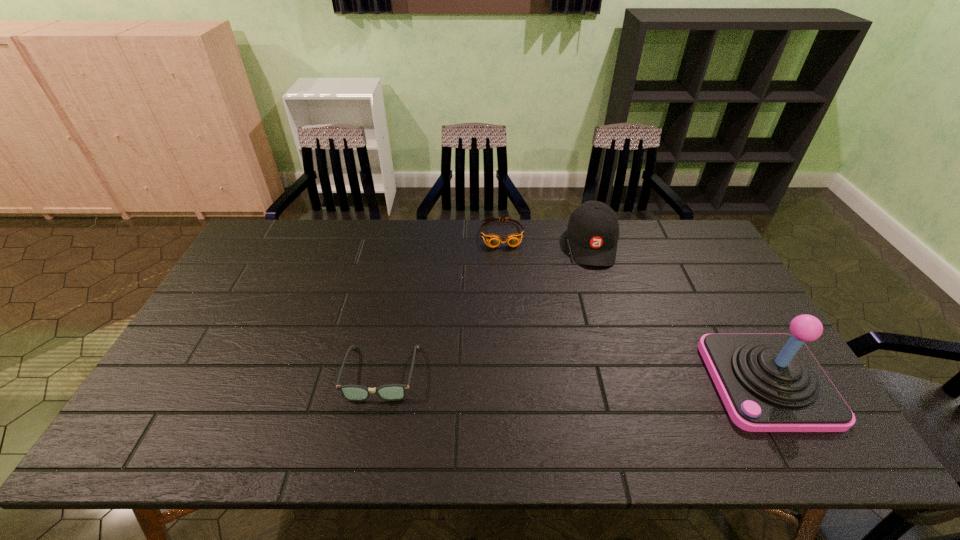
Locate an element on the screen. joystick that is at the near edge is located at coordinates (768, 382).

Where is `object that is at the right edge`? This screenshot has height=540, width=960. object that is at the right edge is located at coordinates (768, 382).

Image resolution: width=960 pixels, height=540 pixels. In order to click on object that is at the near right corner in this screenshot , I will do `click(768, 382)`.

This screenshot has height=540, width=960. I want to click on free space at the far edge, so click(x=370, y=255).

This screenshot has width=960, height=540. In the image, there is a desktop. Identify the location of vacant space at the near edge. (478, 411).

Where is `free space at the right edge of the desktop`? The height and width of the screenshot is (540, 960). free space at the right edge of the desktop is located at coordinates (704, 262).

Where is `free spot at the far left corner of the desktop`? This screenshot has width=960, height=540. free spot at the far left corner of the desktop is located at coordinates (286, 238).

In the image, there is a desktop. Where is `vacant space at the near left corner`? The image size is (960, 540). vacant space at the near left corner is located at coordinates (169, 400).

You are a GUI agent. You are given a task and a screenshot of the screen. Output one action in this format:
    pyautogui.click(x=<x>, y=<y>)
    Task: Click on the vacant space at the far right corner of the desktop
    
    Given the screenshot: What is the action you would take?
    pyautogui.click(x=717, y=262)

Identify the location of free space between the leftmost object and the second tallest object. The width and height of the screenshot is (960, 540). (487, 309).